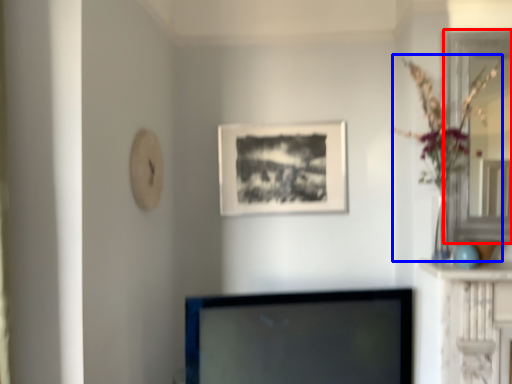
Question: Which object is closer to the camera taking this photo, glass door (highlighted by a red box) or floral arrangement (highlighted by a blue box)?

Choices:
 (A) glass door
 (B) floral arrangement

Answer: (B)